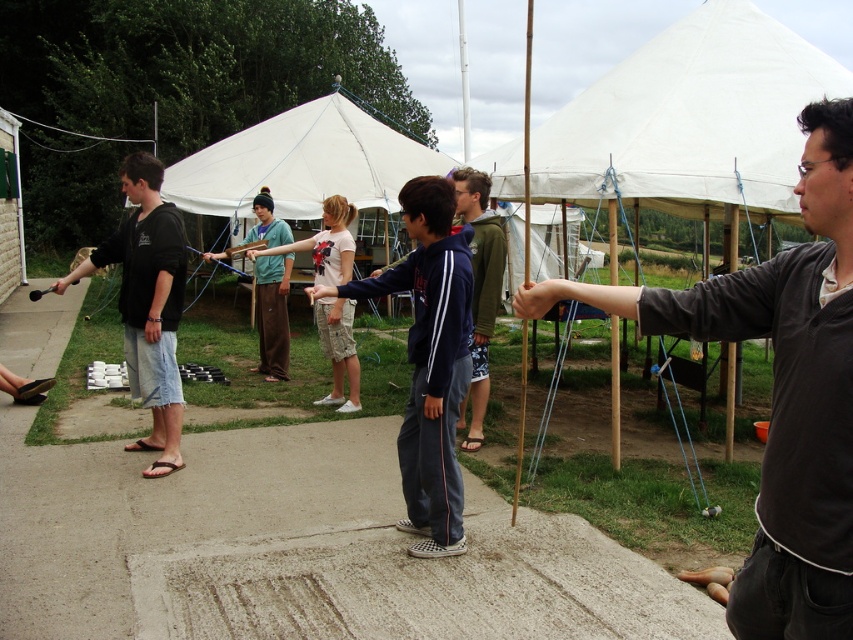
You are a photographer positioned at the end of the concrete path. You want to take a photo that includes both the navy blue hoodie at center and the black cotton shirt at left. Which person should you adjust to be closer to the camera to ensure both are in focus?

The navy blue hoodie at center is already in front of the black cotton shirt at left, so you should adjust the black cotton shirt at left to move closer to the camera to ensure both are in focus.

You are a photographer trying to capture a group photo of the people wearing the dark gray sweater at center and under the white canvas canopy at upper center. Which object should you focus on first to ensure everyone is in frame?

The dark gray sweater at center should be focused on first because it is larger in size compared to the white canvas canopy at upper center, making it more prominent in the scene.

You are planning to set up a picnic under the white canvas canopy at upper center and the black cotton shirt at left. Which object would provide more shade coverage for your picnic setup?

The black cotton shirt at left provides more shade coverage for your picnic setup because it is larger than the white canvas canopy at upper center.